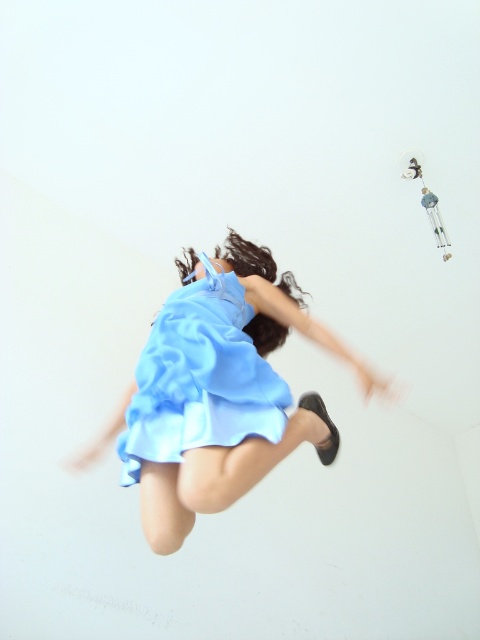
Question: Can you confirm if light blue fabric dress at center is wider than matte blue dress at center?

Choices:
 (A) no
 (B) yes

Answer: (B)

Question: Does light blue fabric dress at center appear under matte blue dress at center?

Choices:
 (A) yes
 (B) no

Answer: (A)

Question: Is light blue fabric dress at center closer to the viewer compared to matte blue dress at center?

Choices:
 (A) no
 (B) yes

Answer: (B)